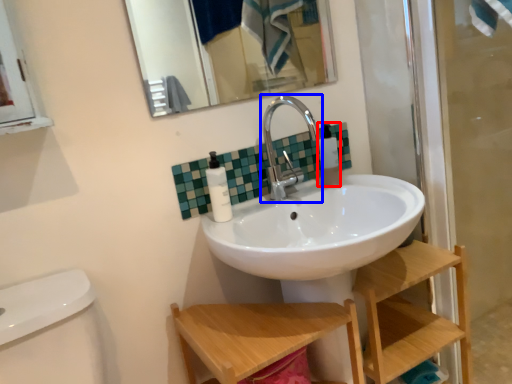
Question: Which object is closer to the camera taking this photo, toiletry (highlighted by a red box) or tap (highlighted by a blue box)?

Choices:
 (A) toiletry
 (B) tap

Answer: (B)